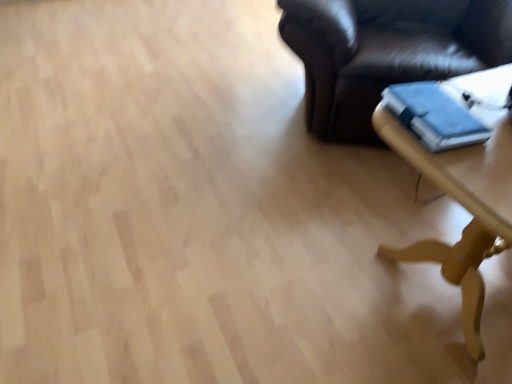
Question: Is light brown wooden table at lower right surrounding blue matte book at right?

Choices:
 (A) yes
 (B) no

Answer: (B)

Question: Is light brown wooden table at lower right completely or partially outside of blue matte book at right?

Choices:
 (A) no
 (B) yes

Answer: (B)

Question: Is light brown wooden table at lower right further to camera compared to blue matte book at right?

Choices:
 (A) yes
 (B) no

Answer: (B)

Question: Is light brown wooden table at lower right touching blue matte book at right?

Choices:
 (A) no
 (B) yes

Answer: (B)

Question: Considering the relative sizes of light brown wooden table at lower right and blue matte book at right in the image provided, is light brown wooden table at lower right smaller than blue matte book at right?

Choices:
 (A) no
 (B) yes

Answer: (A)

Question: Is there a large distance between light brown wooden table at lower right and blue matte book at right?

Choices:
 (A) yes
 (B) no

Answer: (B)

Question: Is blue matte book at right thinner than light brown wooden table at lower right?

Choices:
 (A) yes
 (B) no

Answer: (A)

Question: Is blue matte book at right positioned beyond the bounds of light brown wooden table at lower right?

Choices:
 (A) no
 (B) yes

Answer: (B)

Question: From the image's perspective, would you say blue matte book at right is shown under light brown wooden table at lower right?

Choices:
 (A) yes
 (B) no

Answer: (B)

Question: Is light brown wooden table at lower right completely or partially inside blue matte book at right?

Choices:
 (A) no
 (B) yes

Answer: (A)

Question: Could you tell me if blue matte book at right is turned towards light brown wooden table at lower right?

Choices:
 (A) yes
 (B) no

Answer: (B)

Question: Is blue matte book at right smaller than light brown wooden table at lower right?

Choices:
 (A) no
 (B) yes

Answer: (B)

Question: In terms of height, does light brown wooden table at lower right look taller or shorter compared to blue matte book at right?

Choices:
 (A) tall
 (B) short

Answer: (A)